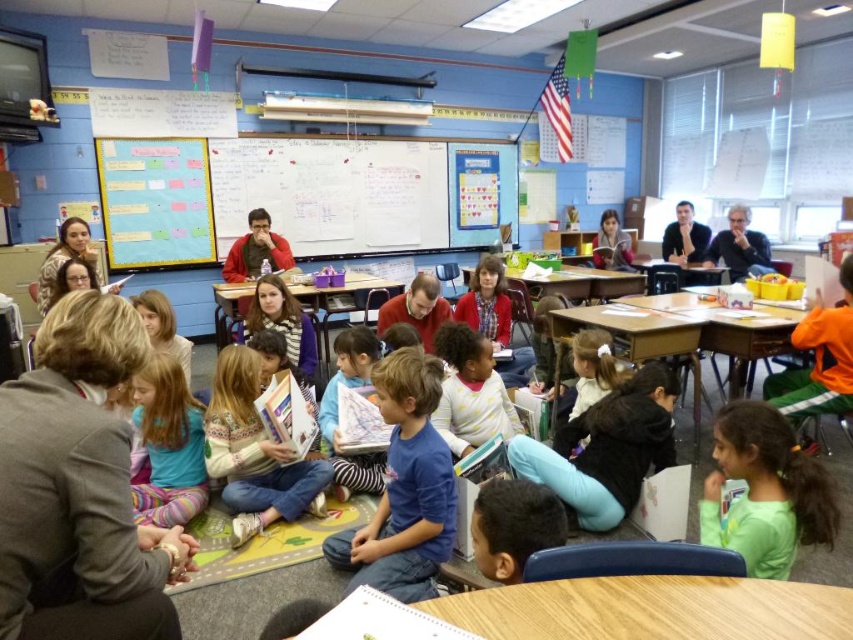
Question: Which of the following is the farthest from the observer?

Choices:
 (A) gray wool sweater at lower left
 (B) yellow dotted sweater at center

Answer: (B)

Question: Can you confirm if pastel striped leggings at lower left is positioned to the left of striped sweater at center?

Choices:
 (A) yes
 (B) no

Answer: (A)

Question: Considering the relative positions of pastel striped leggings at lower left and striped sweater at center in the image provided, where is pastel striped leggings at lower left located with respect to striped sweater at center?

Choices:
 (A) above
 (B) below

Answer: (B)

Question: Does gray wool sweater at lower left lie behind matte black shirt at upper right?

Choices:
 (A) yes
 (B) no

Answer: (B)

Question: Considering the real-world distances, which object is closest to the green matte shirt at lower right?

Choices:
 (A) yellow dotted sweater at center
 (B) knitted sweater at center
 (C) matte red sweater at center

Answer: (A)

Question: Which of the following is the farthest from the observer?

Choices:
 (A) matte black shirt at upper right
 (B) striped sweater at center

Answer: (A)